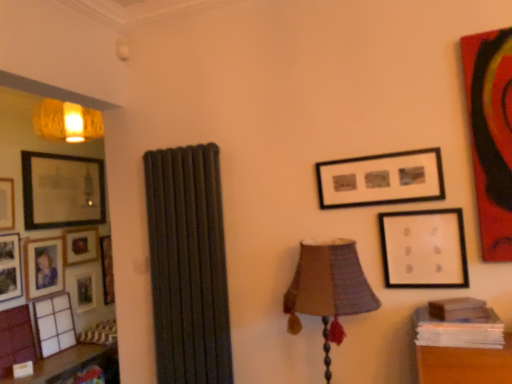
What are the coordinates of `matte wooden picture frame at left, the 8th picture frame positioned from the front` in the screenshot? It's located at (83, 285).

The height and width of the screenshot is (384, 512). What do you see at coordinates (68, 364) in the screenshot?
I see `wooden table at left` at bounding box center [68, 364].

What do you see at coordinates (10, 267) in the screenshot? I see `wooden photo frame at left, placed as the 6th picture frame when sorted from back to front` at bounding box center [10, 267].

Where is `matte glass picture frame at left, the sixth picture frame in the front-to-back sequence`? This screenshot has width=512, height=384. matte glass picture frame at left, the sixth picture frame in the front-to-back sequence is located at coordinates (62, 191).

Locate an element on the screen. The height and width of the screenshot is (384, 512). matte black picture frame at upper right, arranged as the seventh picture frame when viewed from the back is located at coordinates (381, 179).

Identify the location of matte wooden picture frame at left, which is the sixth picture frame in left-to-right order. This screenshot has width=512, height=384. (83, 285).

Looking at this image, is the depth of matte glass picture frame at left, the sixth picture frame in the front-to-back sequence, greater than that of matte black picture frame at left, the fifth picture frame from the front?

Yes, matte glass picture frame at left, the sixth picture frame in the front-to-back sequence, is further from the viewer.

Which is closer, (x=59, y=196) or (x=36, y=255)?

The point (x=36, y=255) is closer.

Considering the sizes of objects matte glass picture frame at left, placed as the sixth picture frame when sorted from right to left, and matte black picture frame at left, which is the 5th picture frame in right-to-left order, in the image provided, who is bigger, matte glass picture frame at left, placed as the sixth picture frame when sorted from right to left, or matte black picture frame at left, which is the 5th picture frame in right-to-left order,?

With larger size is matte glass picture frame at left, placed as the sixth picture frame when sorted from right to left.

Is matte black picture frame at left, which ranks as the 1th picture frame in left-to-right order, a part of wooden photo frame at left, which appears as the 7th picture frame when viewed from the right?

No, matte black picture frame at left, which ranks as the 1th picture frame in left-to-right order, is not surrounded by wooden photo frame at left, which appears as the 7th picture frame when viewed from the right.

From the image's perspective, who appears lower, wooden photo frame at left, placed as the 6th picture frame when sorted from back to front, or matte black picture frame at left, marked as the eighth picture frame in a right-to-left arrangement?

wooden photo frame at left, placed as the 6th picture frame when sorted from back to front, appears lower in the image.

Would you say wooden photo frame at left, placed as the 6th picture frame when sorted from back to front, is a long distance from matte black picture frame at left, which ranks as the 1th picture frame in left-to-right order?

wooden photo frame at left, placed as the 6th picture frame when sorted from back to front, is actually quite close to matte black picture frame at left, which ranks as the 1th picture frame in left-to-right order.

From a real-world perspective, is matte wooden picture frame at left, arranged as the 1th picture frame when viewed from the back, physically below matte black picture frame at left, the 4th picture frame viewed from the left?

Indeed, from a real-world perspective, matte wooden picture frame at left, arranged as the 1th picture frame when viewed from the back, is positioned beneath matte black picture frame at left, the 4th picture frame viewed from the left.

How distant is matte wooden picture frame at left, the 8th picture frame positioned from the front, from matte black picture frame at left, the fifth picture frame from the front?

matte wooden picture frame at left, the 8th picture frame positioned from the front, is 29.36 centimeters away from matte black picture frame at left, the fifth picture frame from the front.

Would you say matte wooden picture frame at left, which is the 3th picture frame from right to left, is a long distance from matte black picture frame at left, which is the 5th picture frame in right-to-left order?

No, matte wooden picture frame at left, which is the 3th picture frame from right to left, is in close proximity to matte black picture frame at left, which is the 5th picture frame in right-to-left order.

Could matte black picture frame at left, the fifth picture frame from the front, be considered to be inside matte wooden picture frame at left, the 8th picture frame positioned from the front?

No, matte black picture frame at left, the fifth picture frame from the front, is located outside of matte wooden picture frame at left, the 8th picture frame positioned from the front.

Is matte wooden picture frame at left, which is the 3th picture frame from right to left, oriented away from wooden photo frame at left, which ranks as the 3th picture frame in front-to-back order?

No, matte wooden picture frame at left, which is the 3th picture frame from right to left, is not facing away from wooden photo frame at left, which ranks as the 3th picture frame in front-to-back order.

From a real-world perspective, is matte wooden picture frame at left, which is the 3th picture frame from right to left, on top of wooden photo frame at left, which appears as the 7th picture frame when viewed from the right?

Incorrect, from a real-world perspective, matte wooden picture frame at left, which is the 3th picture frame from right to left, is lower than wooden photo frame at left, which appears as the 7th picture frame when viewed from the right.

Is matte wooden picture frame at left, the 8th picture frame positioned from the front, far from wooden photo frame at left, which ranks as the 3th picture frame in front-to-back order?

No, matte wooden picture frame at left, the 8th picture frame positioned from the front, is not far from wooden photo frame at left, which ranks as the 3th picture frame in front-to-back order.

From the image's perspective, which picture frame is the 2nd one above the matte wooden picture frame at left, arranged as the 1th picture frame when viewed from the back? Please provide its 2D coordinates.

[(10, 267)]

Is matte black picture frame at upper right, which ranks as the 2th picture frame in right-to-left order, oriented away from matte black picture frame at left, which ranks as the 1th picture frame in left-to-right order?

No, matte black picture frame at upper right, which ranks as the 2th picture frame in right-to-left order, is not facing the opposite direction of matte black picture frame at left, which ranks as the 1th picture frame in left-to-right order.

How distant is matte black picture frame at upper right, which ranks as the 2th picture frame in right-to-left order, from matte black picture frame at left, which ranks as the 1th picture frame in left-to-right order?

matte black picture frame at upper right, which ranks as the 2th picture frame in right-to-left order, is 3.09 meters away from matte black picture frame at left, which ranks as the 1th picture frame in left-to-right order.

Which is in front, point (352, 181) or point (6, 183)?

The point (352, 181) is more forward.

Considering the relative sizes of matte black picture frame at upper right, which is the second picture frame from front to back, and matte black picture frame at left, marked as the eighth picture frame in a right-to-left arrangement, in the image provided, is matte black picture frame at upper right, which is the second picture frame from front to back, smaller than matte black picture frame at left, marked as the eighth picture frame in a right-to-left arrangement,?

No, matte black picture frame at upper right, which is the second picture frame from front to back, is not smaller than matte black picture frame at left, marked as the eighth picture frame in a right-to-left arrangement.

From a real-world perspective, which is physically above, wooden table at left or matte black picture frame at upper right, which ranks as the 2th picture frame in right-to-left order?

matte black picture frame at upper right, which ranks as the 2th picture frame in right-to-left order.

Considering the sizes of wooden table at left and matte black picture frame at upper right, which is the second picture frame from front to back, in the image, is wooden table at left wider or thinner than matte black picture frame at upper right, which is the second picture frame from front to back,?

wooden table at left is wider than matte black picture frame at upper right, which is the second picture frame from front to back.

This screenshot has width=512, height=384. I want to click on the 8th picture frame above the wooden table at left (from the image's perspective), so click(x=381, y=179).

Is point (69, 375) farther from camera compared to point (327, 176)?

Yes, it is behind point (327, 176).

In the scene shown: Could you tell me if matte black picture frame at upper right, which is the second picture frame from front to back, is facing wooden photo frame at left, placed as the 2th picture frame when sorted from left to right?

No.

Does matte black picture frame at upper right, arranged as the seventh picture frame when viewed from the back, have a greater height compared to wooden photo frame at left, placed as the 2th picture frame when sorted from left to right?

In fact, matte black picture frame at upper right, arranged as the seventh picture frame when viewed from the back, may be shorter than wooden photo frame at left, placed as the 2th picture frame when sorted from left to right.

Looking at this image, visually, is matte black picture frame at upper right, arranged as the seventh picture frame when viewed from the back, positioned to the left or to the right of wooden photo frame at left, which appears as the 7th picture frame when viewed from the right?

In the image, matte black picture frame at upper right, arranged as the seventh picture frame when viewed from the back, appears on the right side of wooden photo frame at left, which appears as the 7th picture frame when viewed from the right.

From a real-world perspective, which picture frame is the 6th one above the matte black picture frame at left, the fifth picture frame from the front? Please provide its 2D coordinates.

[(62, 191)]

Locate an element on the screen. The image size is (512, 384). the 1st picture frame in front of the matte black picture frame at left, marked as the eighth picture frame in a right-to-left arrangement is located at coordinates [10, 267].

Looking at the image, which one is located further to matte gold picture frame at left, which is the second picture frame in back-to-front order, wooden photo frame at left, which ranks as the 3th picture frame in front-to-back order, or wooden table at left?

wooden table at left is positioned further to the anchor matte gold picture frame at left, which is the second picture frame in back-to-front order.

Considering their positions, is matte wooden picture frame at left, the 8th picture frame positioned from the front, positioned further to matte gold picture frame at left, which appears as the 4th picture frame when viewed from the right, than wooden photo frame at left, placed as the 6th picture frame when sorted from back to front?

Among the two, wooden photo frame at left, placed as the 6th picture frame when sorted from back to front, is located further to matte gold picture frame at left, which appears as the 4th picture frame when viewed from the right.

When comparing their distances from matte black picture frame at upper right, which is the second picture frame from front to back, does matte gold picture frame at left, placed as the 7th picture frame when sorted from front to back, or textured fabric lampshade at center-right seem further?

Among the two, matte gold picture frame at left, placed as the 7th picture frame when sorted from front to back, is located further to matte black picture frame at upper right, which is the second picture frame from front to back.

Based on their spatial positions, is matte black picture frame at left, which is the 5th picture frame in right-to-left order, or matte wooden picture frame at left, which is the 3th picture frame from right to left, further from matte glass picture frame at left, the 3th picture frame viewed from the back?

Among the two, matte wooden picture frame at left, which is the 3th picture frame from right to left, is located further to matte glass picture frame at left, the 3th picture frame viewed from the back.

Considering their positions, is wooden table at left positioned further to matte gold picture frame at left, which is the 5th picture frame in left-to-right order, than matte black picture frame at left, which ranks as the 1th picture frame in left-to-right order?

wooden table at left.

Considering their positions, is wooden photo frame at left, placed as the 2th picture frame when sorted from left to right, positioned further to matte black picture frame at upper right, arranged as the seventh picture frame when viewed from the back, than textured fabric lampshade at center-right?

Among the two, wooden photo frame at left, placed as the 2th picture frame when sorted from left to right, is located further to matte black picture frame at upper right, arranged as the seventh picture frame when viewed from the back.

Consider the image. Based on their spatial positions, is textured fabric lampshade at center-right or matte glass picture frame at left, the sixth picture frame in the front-to-back sequence, further from matte black picture frame at left, marked as the eighth picture frame in a right-to-left arrangement?

The object further to matte black picture frame at left, marked as the eighth picture frame in a right-to-left arrangement, is textured fabric lampshade at center-right.

Looking at the image, which one is located closer to wooden table at left, matte black picture frame at left, the 4th picture frame viewed from the back, or matte wooden picture frame at left, which is the 3th picture frame from right to left?

Among the two, matte wooden picture frame at left, which is the 3th picture frame from right to left, is located nearer to wooden table at left.

Locate an element on the screen. This screenshot has width=512, height=384. lamp between wooden photo frame at left, which appears as the 7th picture frame when viewed from the right, and matte black picture frame at upper right, which ranks as the 2th picture frame in right-to-left order, from left to right is located at coordinates (328, 290).

You are a GUI agent. You are given a task and a screenshot of the screen. Output one action in this format:
    pyautogui.click(x=<x>, y=<y>)
    Task: Click on the table situated between matte wooden picture frame at left, arranged as the 1th picture frame when viewed from the back, and matte black picture frame at upper right, arranged as the seventh picture frame when viewed from the back, from left to right
    This screenshot has height=384, width=512.
    Given the screenshot: What is the action you would take?
    pyautogui.click(x=68, y=364)

Where is `table located between matte black picture frame at left, which is the 5th picture frame in right-to-left order, and white matte picture frame at upper right, marked as the 8th picture frame in a left-to-right arrangement, in the left-right direction`? The height and width of the screenshot is (384, 512). table located between matte black picture frame at left, which is the 5th picture frame in right-to-left order, and white matte picture frame at upper right, marked as the 8th picture frame in a left-to-right arrangement, in the left-right direction is located at coordinates (68, 364).

Identify the location of table located between matte gold picture frame at left, which is the 5th picture frame in left-to-right order, and white matte picture frame at upper right, the eighth picture frame viewed from the back, in the left-right direction. [68, 364].